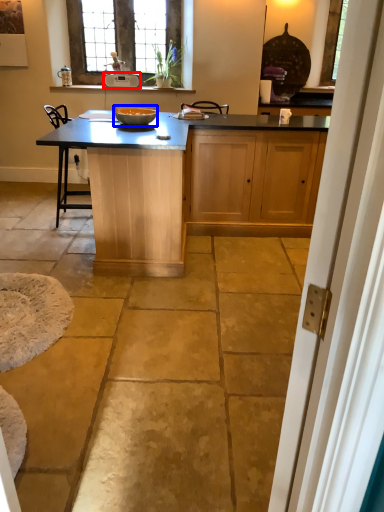
Question: Which of the following is the closest to the observer, appliance (highlighted by a red box) or bowl (highlighted by a blue box)?

Choices:
 (A) appliance
 (B) bowl

Answer: (B)